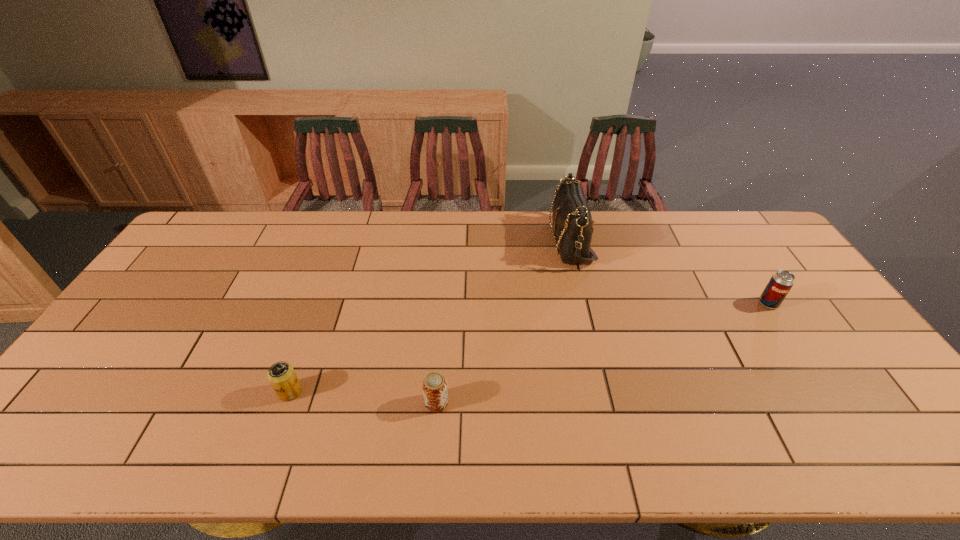
This screenshot has height=540, width=960. Identify the location of the third object from left to right. (572, 220).

Where is `the farthest object`? The height and width of the screenshot is (540, 960). the farthest object is located at coordinates (572, 220).

Locate an element on the screen. This screenshot has width=960, height=540. the rightmost object is located at coordinates (781, 282).

Find the location of `the rightmost beer can`. the rightmost beer can is located at coordinates (781, 282).

The image size is (960, 540). What are the coordinates of `the leftmost object` in the screenshot? It's located at (281, 375).

The image size is (960, 540). I want to click on the second beer can from right to left, so click(434, 385).

Locate an element on the screen. Image resolution: width=960 pixels, height=540 pixels. free region located 0.090m at the front of the handbag with chain and zipper is located at coordinates (524, 241).

Find the location of a particular element. vacant point located 0.180m at the front of the handbag with chain and zipper is located at coordinates [x=498, y=241].

Find the location of a particular element. This screenshot has width=960, height=540. free space located at the front of the handbag with chain and zipper is located at coordinates (461, 241).

Locate an element on the screen. The width and height of the screenshot is (960, 540). vacant space located on the right of the rightmost object is located at coordinates (815, 303).